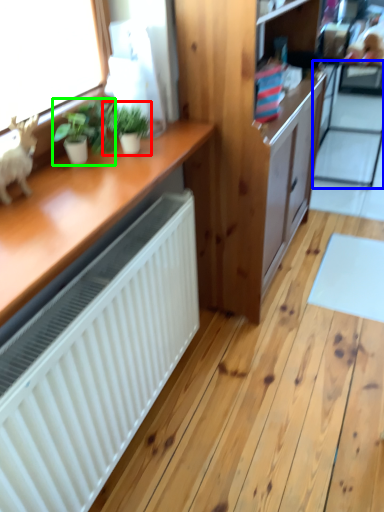
Question: Which is nearer to the houseplant (highlighted by a red box)? screen door (highlighted by a blue box) or houseplant (highlighted by a green box).

Choices:
 (A) screen door
 (B) houseplant

Answer: (B)